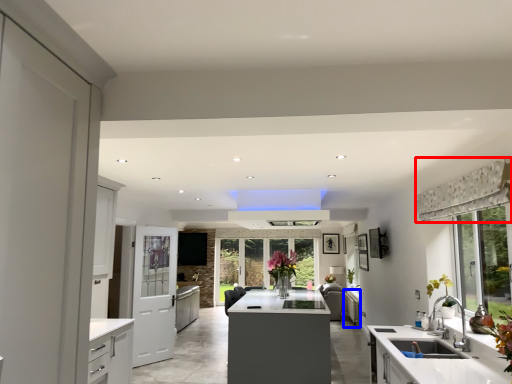
Question: Which of the following is the closest to the observer, curtain (highlighted by a red box) or cabinetry (highlighted by a blue box)?

Choices:
 (A) curtain
 (B) cabinetry

Answer: (A)